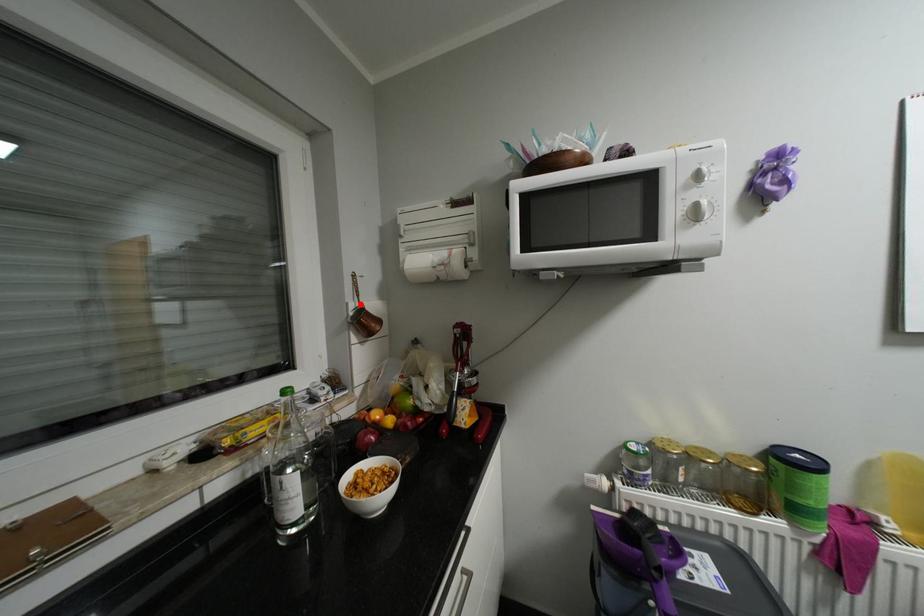
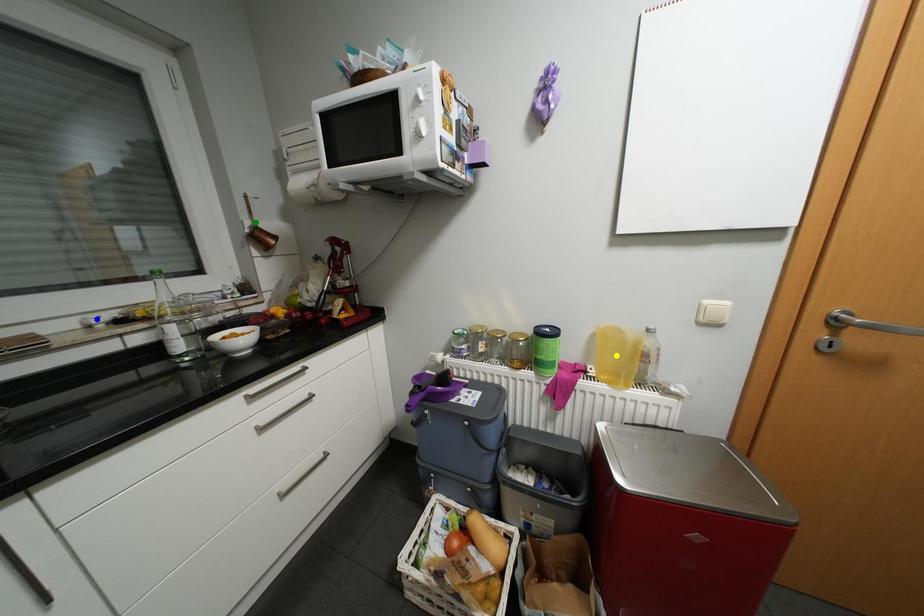
Question: I am providing you with two images of the same scene from different viewpoints. A red point is marked on the first image. You are given multiple points on the second image. Which spot in image 2 lines up with the point in image 1?

Choices:
 (A) green point
 (B) yellow point
 (C) blue point

Answer: (A)